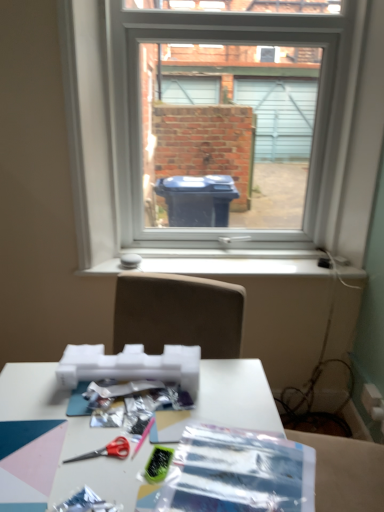
Image resolution: width=384 pixels, height=512 pixels. I want to click on free space in front of red plastic scissors at lower center, so click(80, 488).